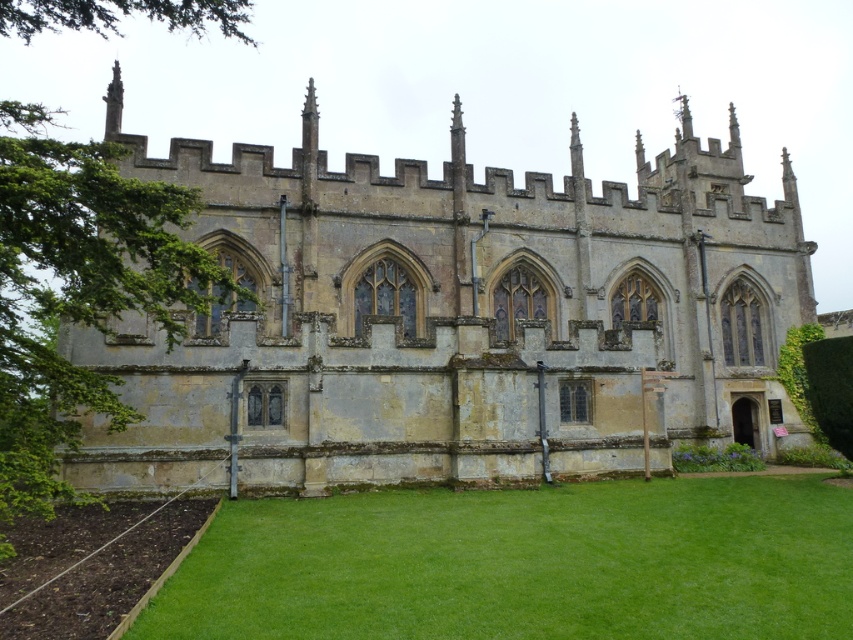
Question: Which object is farther from the camera taking this photo?

Choices:
 (A) green grass at lower center
 (B) stone church at center

Answer: (B)

Question: Is stone church at center to the left of green grass at lower center from the viewer's perspective?

Choices:
 (A) yes
 (B) no

Answer: (B)

Question: Which point is farther to the camera?

Choices:
 (A) (567, 243)
 (B) (247, 513)

Answer: (A)

Question: Is stone church at center above green grass at lower center?

Choices:
 (A) no
 (B) yes

Answer: (B)

Question: Which object is farther from the camera taking this photo?

Choices:
 (A) green grass at lower center
 (B) stone church at center

Answer: (B)

Question: Can you confirm if stone church at center is wider than green grass at lower center?

Choices:
 (A) no
 (B) yes

Answer: (B)